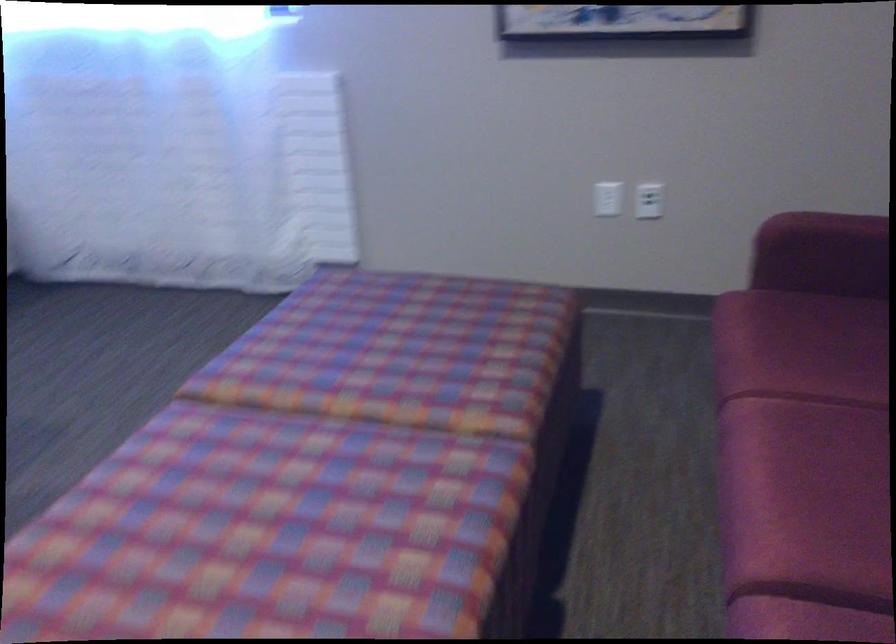
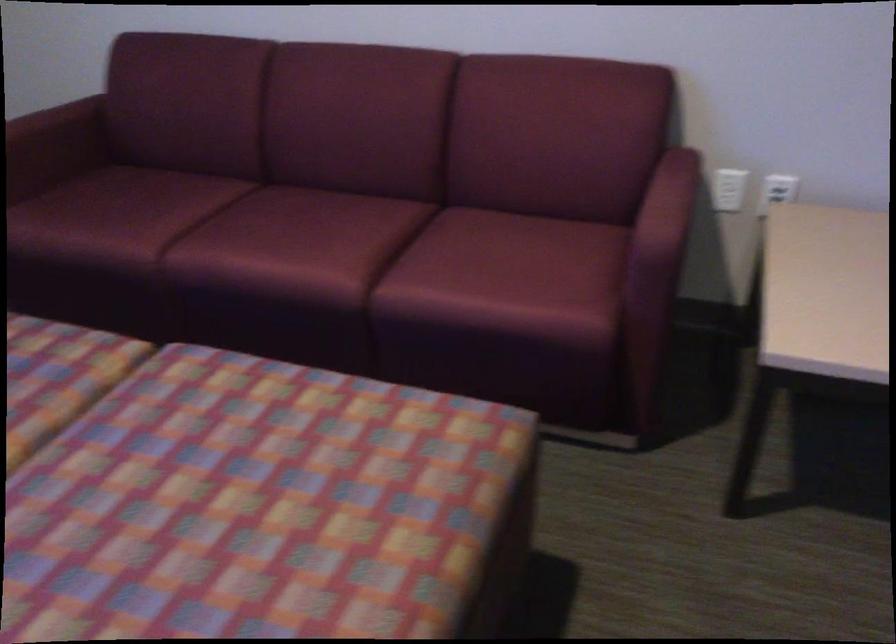
Where in the second image is the point corresponding to point (814, 514) from the first image?

(332, 249)